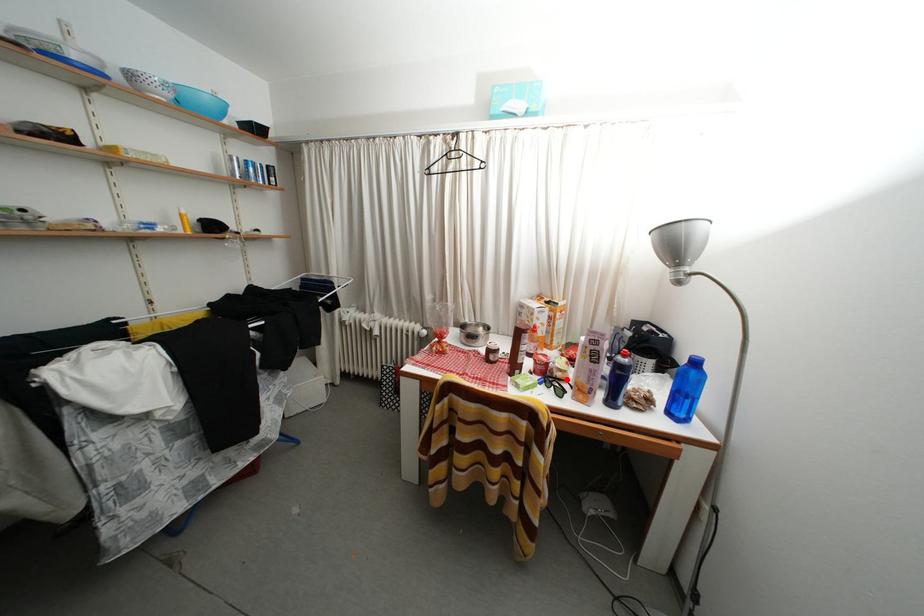
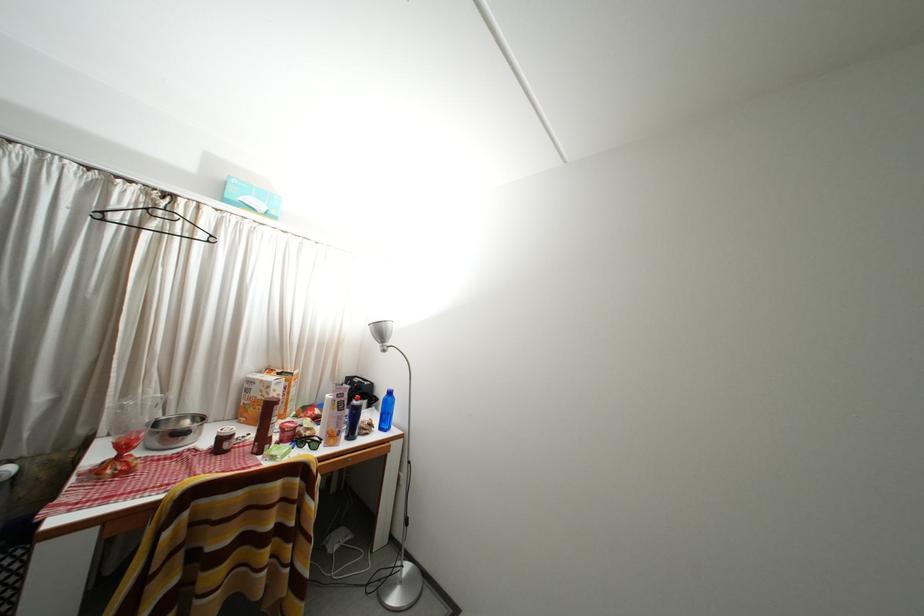
In the second image, find the point that corresponds to the highlighted location in the first image.

(315, 439)